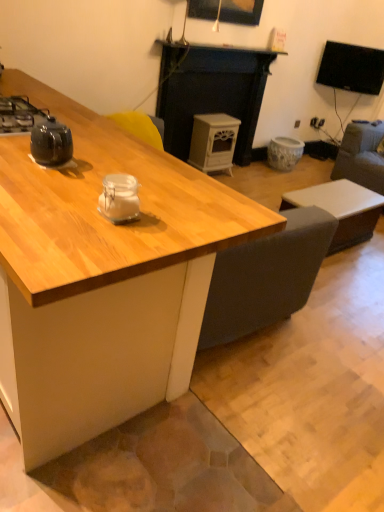
Locate an element on the screen. The width and height of the screenshot is (384, 512). vacant space underneath matte black teapot at left (from a real-world perspective) is located at coordinates (68, 165).